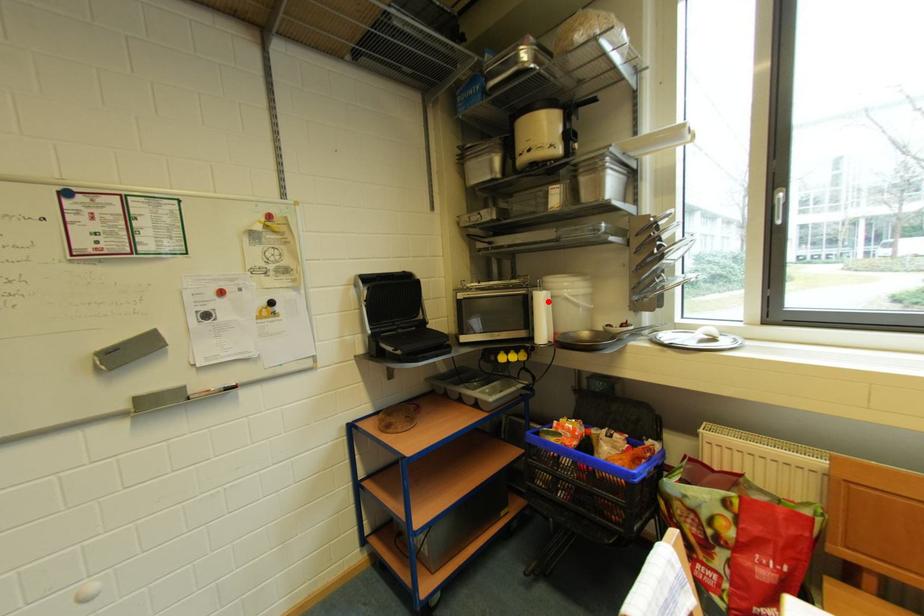
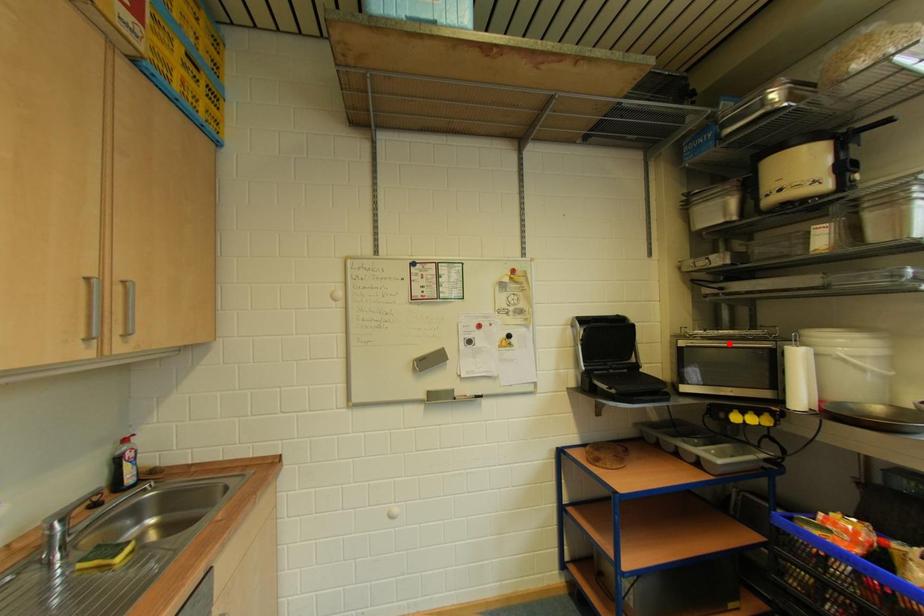
I am providing you with two images of the same scene from different viewpoints. A red point is marked on the first image and another point is marked on the second image. Does the point marked in image1 correspond to the same location as the one in image2?

No